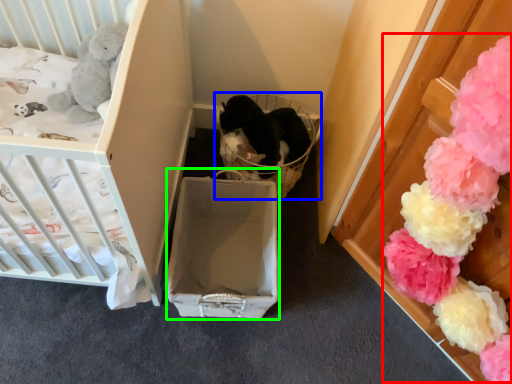
Question: Which object is positioned closest to flower (highlighted by a red box)? Select from baby carriage (highlighted by a blue box) and cardboard box (highlighted by a green box).

Choices:
 (A) baby carriage
 (B) cardboard box

Answer: (B)